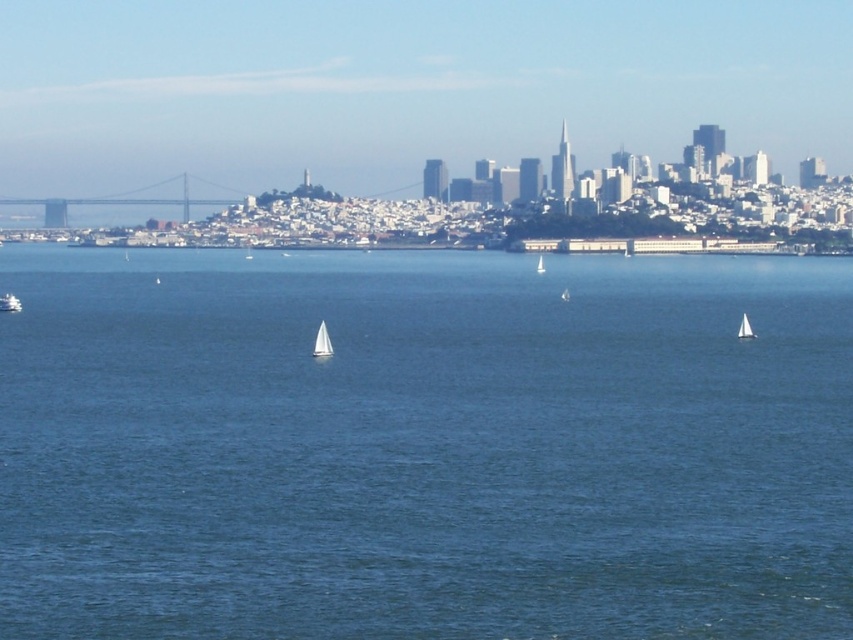
Question: Which is nearer to the metallic gray bridge at left?

Choices:
 (A) white matte sailboat at lower left
 (B) white sailboat at right
 (C) white sailboat at center

Answer: (A)

Question: Which object is the closest to the white sailboat at center?

Choices:
 (A) white sailboat at right
 (B) metallic gray bridge at left

Answer: (B)

Question: From the image, what is the correct spatial relationship of blue water at center in relation to white matte sailboat at lower left?

Choices:
 (A) above
 (B) below

Answer: (B)

Question: Which point is farther to the camera?

Choices:
 (A) white sailboat at right
 (B) white matte sailboat at lower left

Answer: (B)

Question: Does metallic gray bridge at left lie behind white matte sailboat at lower left?

Choices:
 (A) yes
 (B) no

Answer: (A)

Question: Is metallic gray bridge at left bigger than white matte sailboat at lower left?

Choices:
 (A) no
 (B) yes

Answer: (B)